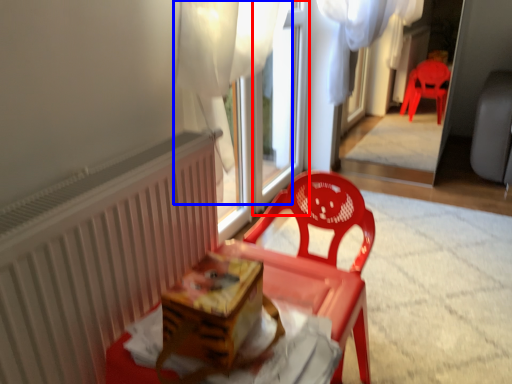
Question: Which point is closer to the camera, window frame (highlighted by a red box) or curtain (highlighted by a blue box)?

Choices:
 (A) window frame
 (B) curtain

Answer: (B)